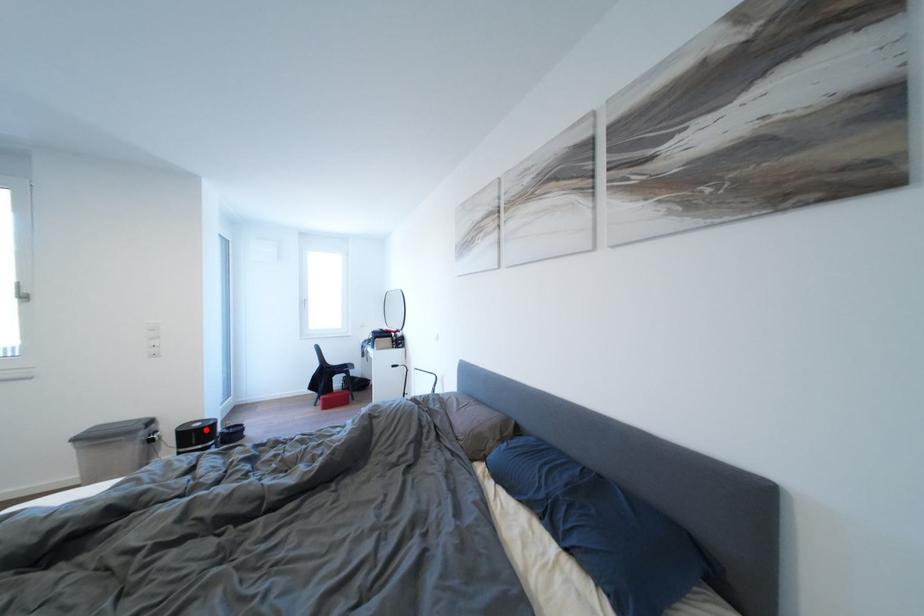
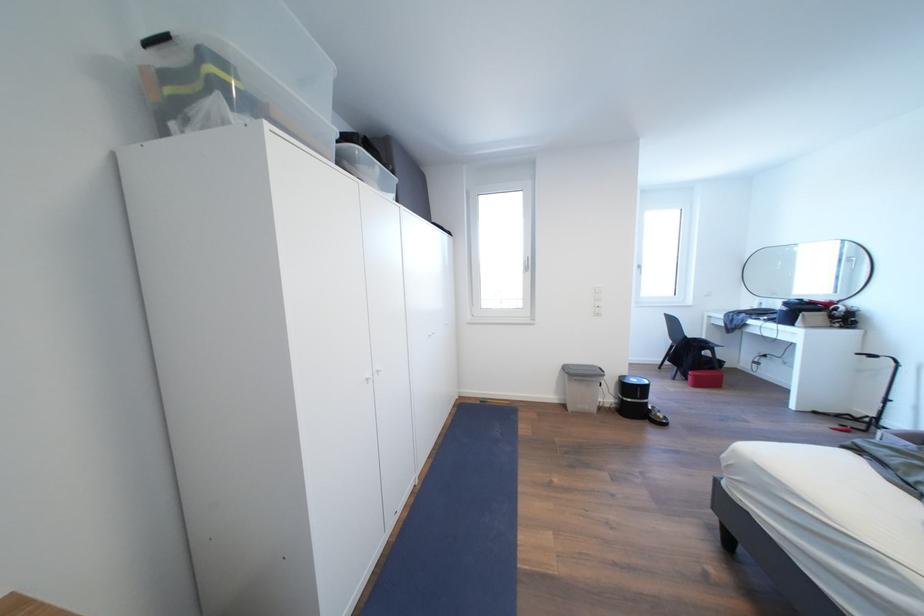
Question: I am providing you with two images of the same scene from different viewpoints. In image1, a red point is highlighted. Considering the same 3D point in image2, which of the following is correct?

Choices:
 (A) It is closer
 (B) It is farther

Answer: (B)